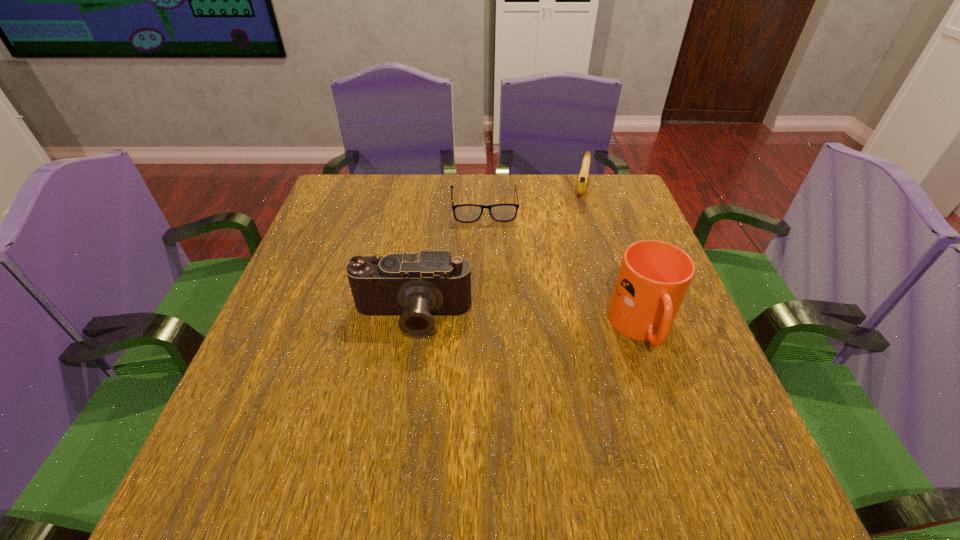
Point out which object is positioned as the third nearest to the mug. Please provide its 2D coordinates. Your answer should be formatted as a tuple, i.e. [(x, y)], where the tuple contains the x and y coordinates of a point satisfying the conditions above.

[(584, 171)]

Find the location of a particular element. The height and width of the screenshot is (540, 960). the third closest object to the spectacles is located at coordinates (654, 276).